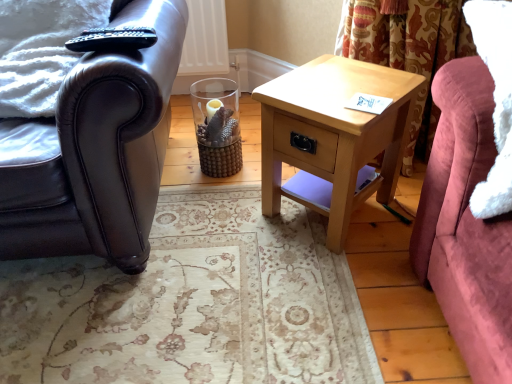
This screenshot has height=384, width=512. What do you see at coordinates (333, 137) in the screenshot?
I see `light wood/texture nightstand at center` at bounding box center [333, 137].

What do you see at coordinates (472, 197) in the screenshot? I see `velvet pink couch at right` at bounding box center [472, 197].

At what (x,y) coordinates should I click in order to perform the action: click on shiny black leather armchair at left. Please return your answer as a coordinate pair (x, y). The height and width of the screenshot is (384, 512). Looking at the image, I should click on (95, 151).

From a real-world perspective, is light wood/texture nightstand at center positioned over shiny black leather armchair at left based on gravity?

No, from a real-world perspective, light wood/texture nightstand at center is not above shiny black leather armchair at left.

Is light wood/texture nightstand at center further to the viewer compared to shiny black leather armchair at left?

That is True.

Looking at this image, from the image's perspective, is light wood/texture nightstand at center located above or below shiny black leather armchair at left?

Clearly, from the image's perspective, light wood/texture nightstand at center is below shiny black leather armchair at left.

Which is more to the left, shiny black leather armchair at left or light wood/texture nightstand at center?

From the viewer's perspective, shiny black leather armchair at left appears more on the left side.

Is shiny black leather armchair at left directly adjacent to light wood/texture nightstand at center?

shiny black leather armchair at left and light wood/texture nightstand at center are not in contact.

Find the location of a particular element. nightstand on the right of shiny black leather armchair at left is located at coordinates (333, 137).

Who is smaller, shiny black leather armchair at left or light wood/texture nightstand at center?

With smaller size is light wood/texture nightstand at center.

From a real-world perspective, which is physically above, shiny black leather armchair at left or velvet pink couch at right?

velvet pink couch at right, from a real-world perspective.

Is point (167, 125) less distant than point (448, 324)?

No.

From the image's perspective, is shiny black leather armchair at left below velvet pink couch at right?

Incorrect, from the image's perspective, shiny black leather armchair at left is higher than velvet pink couch at right.

Is shiny black leather armchair at left taller than velvet pink couch at right?

Yes.

Is light wood/texture nightstand at center surrounding velvet pink couch at right?

Definitely not — velvet pink couch at right is not inside light wood/texture nightstand at center.

Is light wood/texture nightstand at center turned away from velvet pink couch at right?

No.

You are a GUI agent. You are given a task and a screenshot of the screen. Output one action in this format:
    pyautogui.click(x=<x>, y=<y>)
    Task: Click on the studio couch that appears on the right of light wood/texture nightstand at center
    This screenshot has width=512, height=384.
    Given the screenshot: What is the action you would take?
    click(x=472, y=197)

Considering the positions of point (278, 158) and point (432, 282), is point (278, 158) closer or farther from the camera than point (432, 282)?

Point (278, 158).

Between velvet pink couch at right and light wood/texture nightstand at center, which one appears on the left side from the viewer's perspective?

Positioned to the left is light wood/texture nightstand at center.

From their relative heights in the image, would you say velvet pink couch at right is taller or shorter than light wood/texture nightstand at center?

In the image, velvet pink couch at right appears to be taller than light wood/texture nightstand at center.

Is velvet pink couch at right wider than light wood/texture nightstand at center?

Indeed, velvet pink couch at right has a greater width compared to light wood/texture nightstand at center.

Which of these two, velvet pink couch at right or light wood/texture nightstand at center, is bigger?

Bigger between the two is light wood/texture nightstand at center.

From the image's perspective, which one is positioned lower, velvet pink couch at right or shiny black leather armchair at left?

velvet pink couch at right appears lower in the image.

Is point (441, 277) closer to camera compared to point (60, 218)?

Yes, point (441, 277) is in front of point (60, 218).

Between velvet pink couch at right and shiny black leather armchair at left, which one appears on the left side from the viewer's perspective?

From the viewer's perspective, shiny black leather armchair at left appears more on the left side.

Is velvet pink couch at right beside shiny black leather armchair at left?

No.

Find the location of `chair on the left of light wood/texture nightstand at center`. chair on the left of light wood/texture nightstand at center is located at coordinates (95, 151).

In the image, there is a shiny black leather armchair at left. Identify the location of nightstand below it (from a real-world perspective). (333, 137).

When comparing their distances from velvet pink couch at right, does shiny black leather armchair at left or light wood/texture nightstand at center seem further?

shiny black leather armchair at left.

Considering their positions, is light wood/texture nightstand at center positioned further to velvet pink couch at right than shiny black leather armchair at left?

shiny black leather armchair at left is positioned further to the anchor velvet pink couch at right.

From the image, which object appears to be nearer to light wood/texture nightstand at center, velvet pink couch at right or shiny black leather armchair at left?

Among the two, velvet pink couch at right is located nearer to light wood/texture nightstand at center.

Which object lies nearer to the anchor point shiny black leather armchair at left, light wood/texture nightstand at center or velvet pink couch at right?

The object closer to shiny black leather armchair at left is light wood/texture nightstand at center.

Considering their positions, is velvet pink couch at right positioned further to shiny black leather armchair at left than light wood/texture nightstand at center?

The object further to shiny black leather armchair at left is velvet pink couch at right.

From the image, which object appears to be nearer to light wood/texture nightstand at center, shiny black leather armchair at left or velvet pink couch at right?

The object closer to light wood/texture nightstand at center is velvet pink couch at right.

You are a GUI agent. You are given a task and a screenshot of the screen. Output one action in this format:
    pyautogui.click(x=<x>, y=<y>)
    Task: Click on the nightstand situated between shiny black leather armchair at left and velvet pink couch at right from left to right
    Image resolution: width=512 pixels, height=384 pixels.
    Given the screenshot: What is the action you would take?
    pyautogui.click(x=333, y=137)